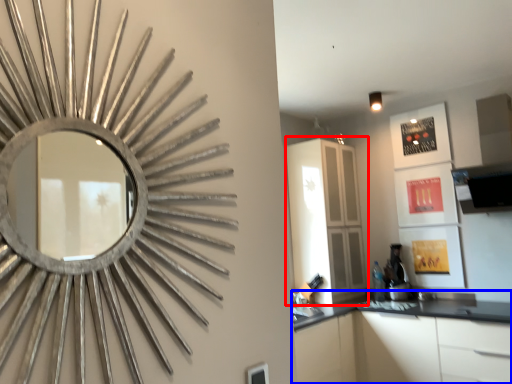
Question: Which object is closer to the camera taking this photo, dresser (highlighted by a red box) or cabinetry (highlighted by a blue box)?

Choices:
 (A) dresser
 (B) cabinetry

Answer: (B)